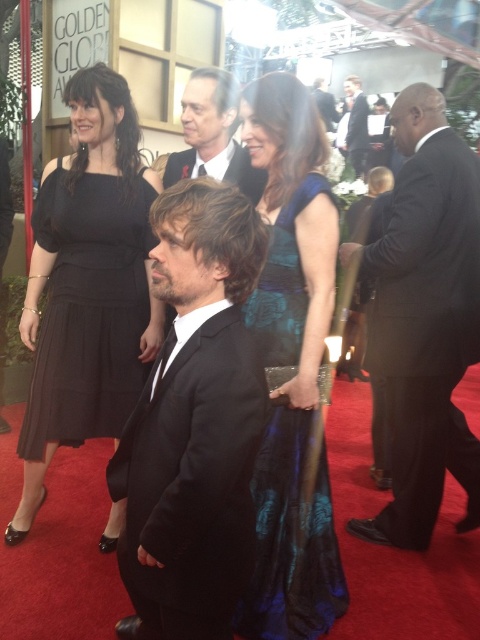
Question: Where is black suit at right located in relation to black suit at center in the image?

Choices:
 (A) below
 (B) above

Answer: (A)

Question: Which is farther from the smooth black suit at center?

Choices:
 (A) black suit at right
 (B) teal satin dress at center
 (C) black suit at center
 (D) black satin suit at center

Answer: (C)

Question: Is black satin dress at left smaller than teal satin dress at center?

Choices:
 (A) no
 (B) yes

Answer: (A)

Question: Can you confirm if black satin dress at left is thinner than smooth black suit at center?

Choices:
 (A) no
 (B) yes

Answer: (A)

Question: Based on their relative distances, which object is farther from the black suit at right?

Choices:
 (A) smooth black suit at center
 (B) teal satin dress at center
 (C) black satin suit at center

Answer: (C)

Question: Which point is farther from the camera taking this photo?

Choices:
 (A) (215, 465)
 (B) (137, 276)
 (C) (220, 176)

Answer: (C)